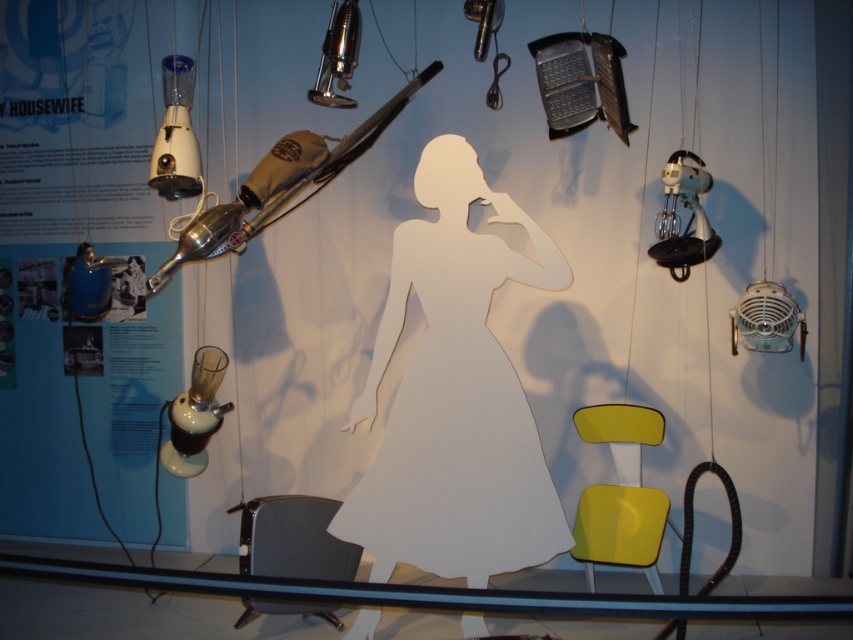
Question: Is the position of yellow matte chair at lower right more distant than that of matte black chair at lower left?

Choices:
 (A) no
 (B) yes

Answer: (B)

Question: Observing the image, what is the correct spatial positioning of transparent glass table at lower center in reference to white plastic blender at upper left?

Choices:
 (A) below
 (B) above

Answer: (A)

Question: Which point is farther from the camera taking this photo?

Choices:
 (A) (352, 589)
 (B) (582, 413)

Answer: (B)

Question: Which object appears closest to the camera in this image?

Choices:
 (A) white paper figure at center
 (B) white plastic blender at upper left
 (C) transparent glass table at lower center
 (D) matte black chair at lower left

Answer: (C)

Question: Which object appears farthest from the camera in this image?

Choices:
 (A) matte black chair at lower left
 (B) transparent glass table at lower center
 (C) white plastic blender at upper left

Answer: (C)

Question: Is yellow matte chair at lower right below matte white lamp at lower left?

Choices:
 (A) no
 (B) yes

Answer: (B)